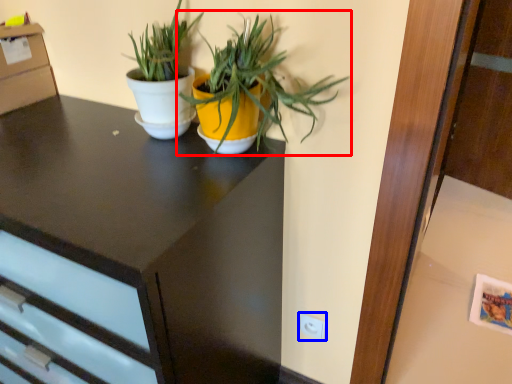
Question: Among these objects, which one is farthest to the camera, houseplant (highlighted by a red box) or electric outlet (highlighted by a blue box)?

Choices:
 (A) houseplant
 (B) electric outlet

Answer: (B)